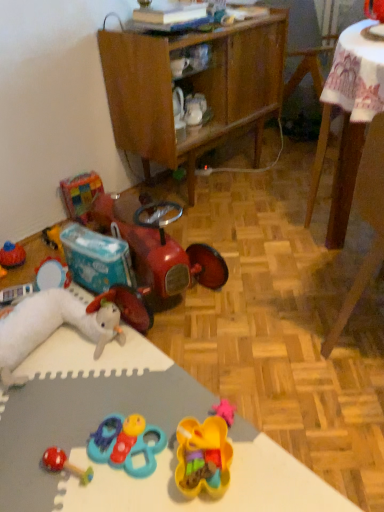
Question: Does rubber duck at center, which is counted as the first toy, starting from the right, appear on the left side of white plush rabbit at lower left, arranged as the sixth toy when viewed from the right?

Choices:
 (A) yes
 (B) no

Answer: (B)

Question: Are rubber duck at center, which appears as the sixth toy when viewed from the left, and white plush rabbit at lower left, arranged as the sixth toy when viewed from the right, making contact?

Choices:
 (A) no
 (B) yes

Answer: (A)

Question: Is white plush rabbit at lower left, the 1th toy from the left, at the back of rubber duck at center, which is counted as the first toy, starting from the right?

Choices:
 (A) yes
 (B) no

Answer: (B)

Question: Is rubber duck at center, which appears as the sixth toy when viewed from the left, oriented towards white plush rabbit at lower left, arranged as the sixth toy when viewed from the right?

Choices:
 (A) no
 (B) yes

Answer: (A)

Question: Can you confirm if rubber duck at center, which is counted as the first toy, starting from the right, is thinner than white plush rabbit at lower left, the 1th toy from the left?

Choices:
 (A) no
 (B) yes

Answer: (B)

Question: Is multicolored plastic blocks at upper left, the second toy in the left-to-right sequence, inside the boundaries of wooden chair at lower right, or outside?

Choices:
 (A) inside
 (B) outside

Answer: (B)

Question: In the image, is multicolored plastic blocks at upper left, marked as the 5th toy in a right-to-left arrangement, on the left side or the right side of wooden chair at lower right?

Choices:
 (A) left
 (B) right

Answer: (A)

Question: Looking at the image, does multicolored plastic blocks at upper left, the second toy in the left-to-right sequence, seem bigger or smaller compared to wooden chair at lower right?

Choices:
 (A) big
 (B) small

Answer: (B)

Question: Is multicolored plastic blocks at upper left, the second toy in the left-to-right sequence, wider or thinner than wooden chair at lower right?

Choices:
 (A) thin
 (B) wide

Answer: (A)

Question: Do you think translucent plastic container at center, the fifth toy viewed from the left, is within wooden chair at lower right, or outside of it?

Choices:
 (A) inside
 (B) outside

Answer: (B)

Question: Visually, is translucent plastic container at center, the fifth toy viewed from the left, positioned to the left or to the right of wooden chair at lower right?

Choices:
 (A) left
 (B) right

Answer: (A)

Question: Considering the positions of point (188, 487) and point (364, 260), is point (188, 487) closer or farther from the camera than point (364, 260)?

Choices:
 (A) farther
 (B) closer

Answer: (B)

Question: In terms of height, does translucent plastic container at center, the fifth toy viewed from the left, look taller or shorter compared to wooden chair at lower right?

Choices:
 (A) tall
 (B) short

Answer: (B)

Question: Is rubberized red car at lower left, placed as the fourth toy when sorted from right to left, inside the boundaries of translucent plastic container at center, marked as the second toy in a right-to-left arrangement, or outside?

Choices:
 (A) outside
 (B) inside

Answer: (A)

Question: Does point (102, 210) appear closer or farther from the camera than point (208, 479)?

Choices:
 (A) closer
 (B) farther

Answer: (B)